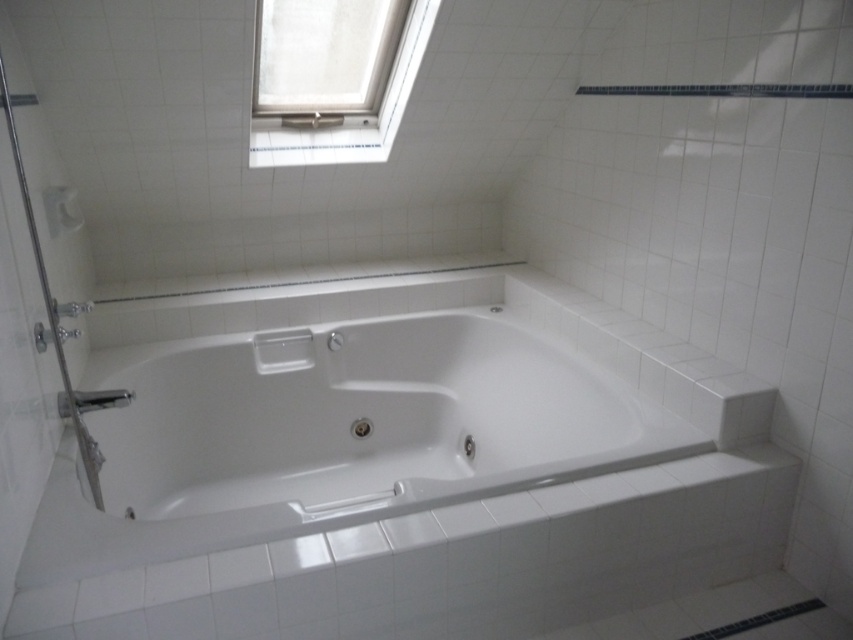
You are standing in the bathroom and see the white glossy bathtub at center. A small point is marked at coordinates (335, 435). Where is this point located relative to the bathtub?

The point at coordinates (335, 435) is located on the white glossy bathtub at center.

You are a plumber inspecting the bathroom and need to locate the faucet relative to the bathtub. Based on the scene, where is the satin nickel faucet at lower left in relation to the white glossy bathtub at center?

The satin nickel faucet at lower left is to the left of the white glossy bathtub at center.

You are standing in the bathroom and want to open the white plastic window at upper center. Based on its position, which direction should you move towards to reach it?

The white plastic window at upper center is located at point [360,125], so you should move towards the upper center direction to reach it.